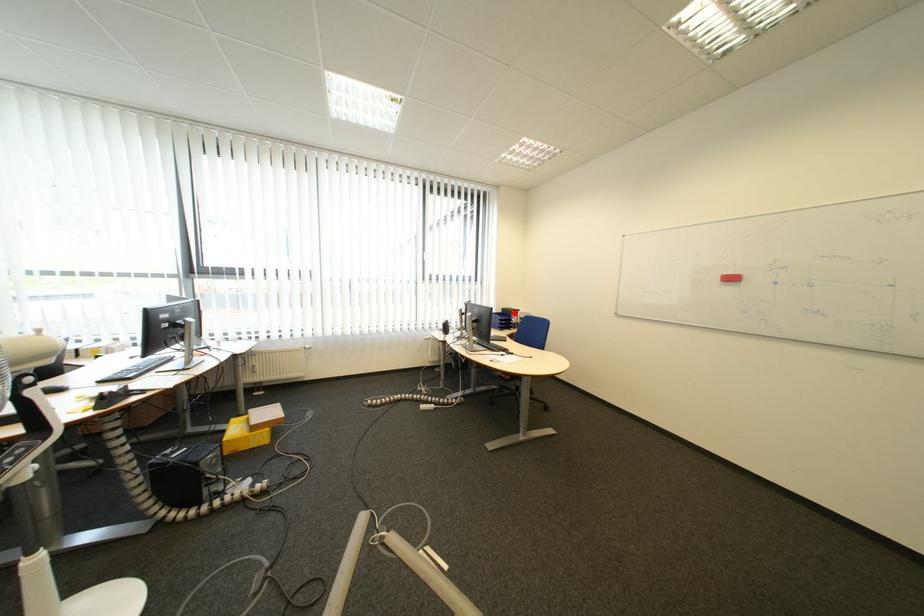
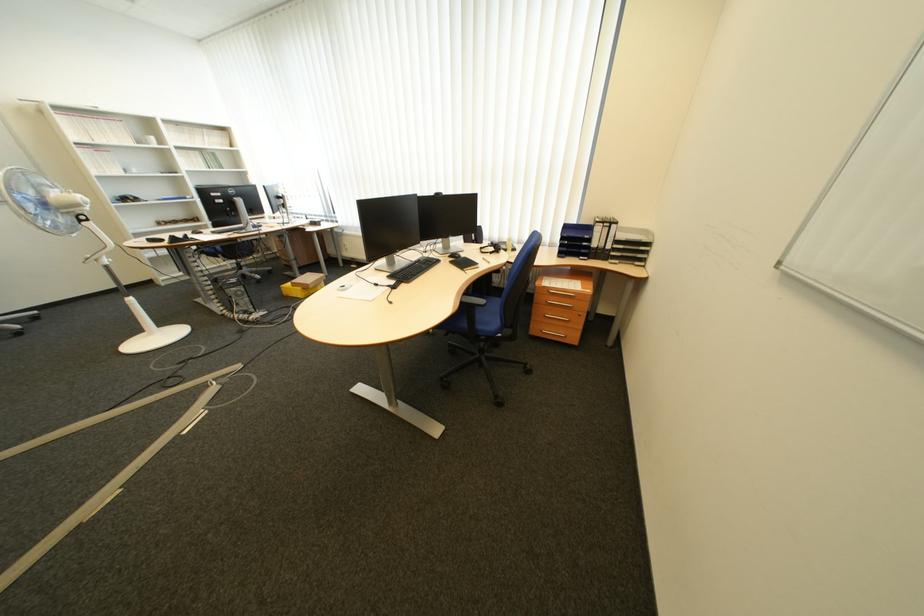
Where in the second image is the point corresponding to the highlighted location from the first image?

(604, 225)